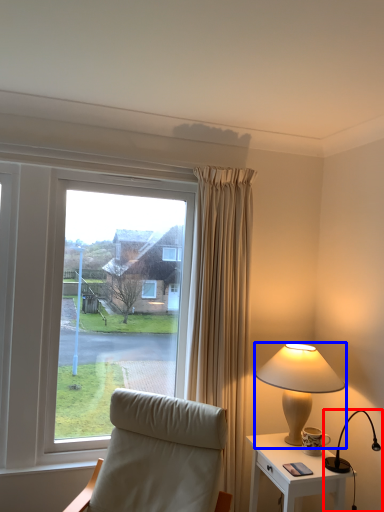
Question: Which of the following is the closest to the observer, lamp (highlighted by a red box) or lamp (highlighted by a blue box)?

Choices:
 (A) lamp
 (B) lamp

Answer: (A)